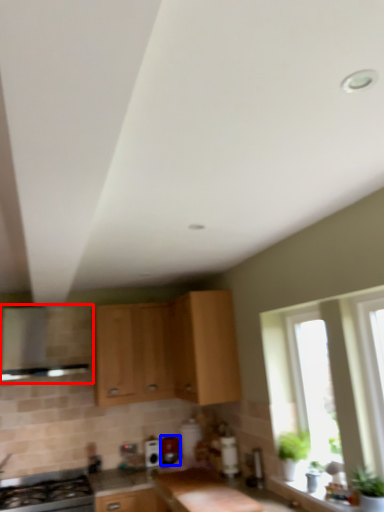
Question: Which of the following is the closest to the observer, vent (highlighted by a red box) or appliance (highlighted by a blue box)?

Choices:
 (A) vent
 (B) appliance

Answer: (A)